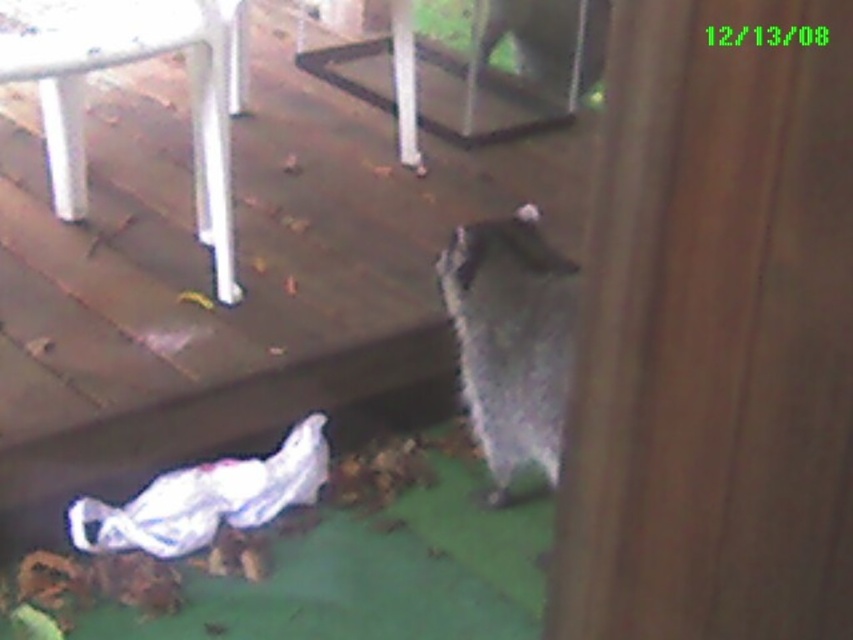
Question: Considering the relative positions of brown wood screen door at right and white plastic chair at upper left in the image provided, where is brown wood screen door at right located with respect to white plastic chair at upper left?

Choices:
 (A) right
 (B) left

Answer: (A)

Question: Which is nearer to the wooden deck at lower left?

Choices:
 (A) white plastic chair at upper left
 (B) brown wood screen door at right

Answer: (A)

Question: Observing the image, what is the correct spatial positioning of brown wood screen door at right in reference to white plastic chair at upper left?

Choices:
 (A) above
 (B) below

Answer: (B)

Question: Which of the following is the farthest from the observer?

Choices:
 (A) fuzzy gray cat at lower right
 (B) brown wood screen door at right

Answer: (A)

Question: In this image, where is wooden deck at lower left located relative to fuzzy gray cat at lower right?

Choices:
 (A) right
 (B) left

Answer: (B)

Question: Which object is the closest to the brown wood screen door at right?

Choices:
 (A) white plastic chair at upper left
 (B) wooden deck at lower left
 (C) fuzzy gray cat at lower right

Answer: (C)